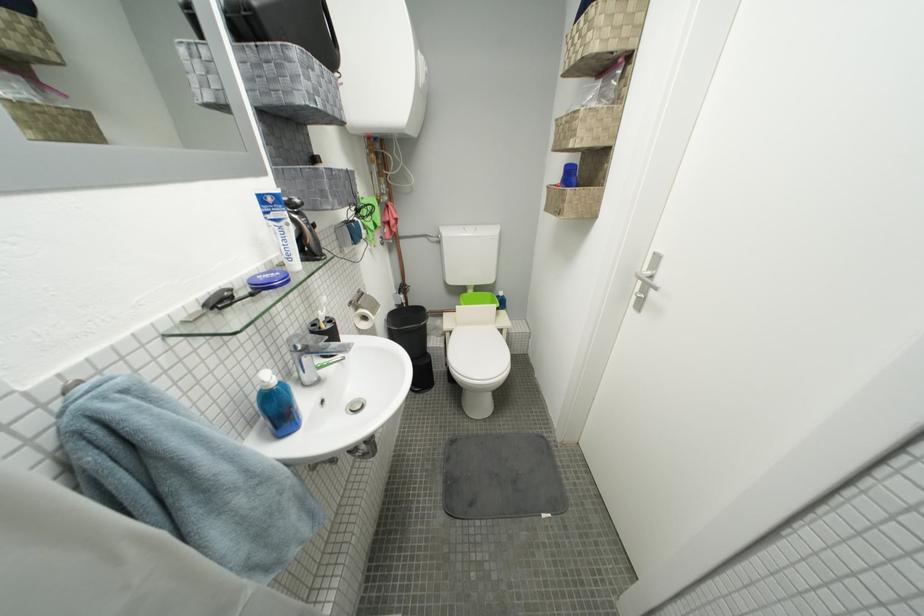
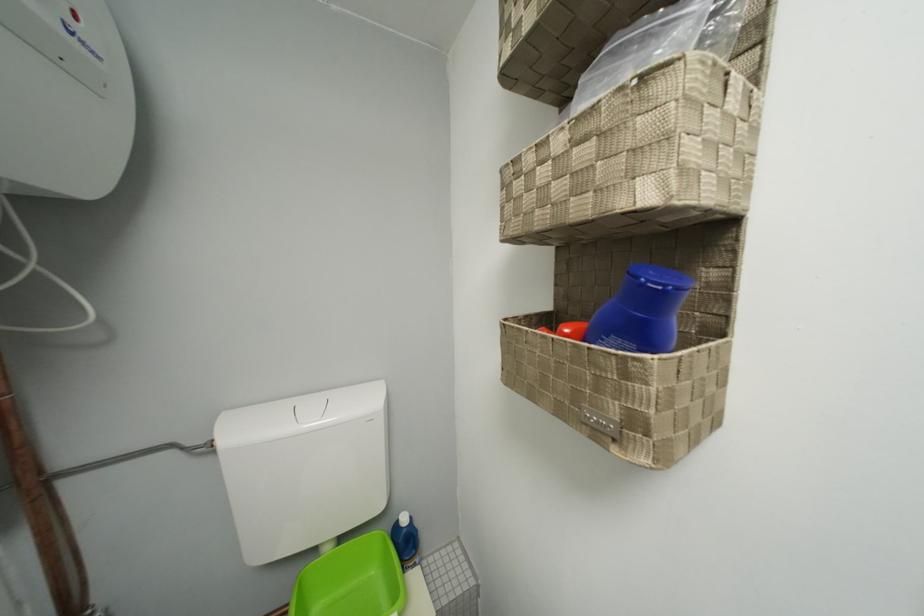
Locate, in the second image, the point that corresponds to (480,294) in the first image.

(335, 552)